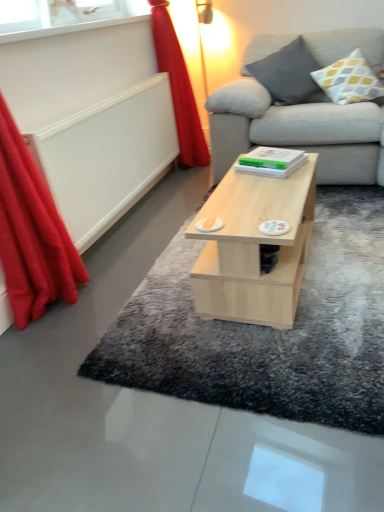
Where is `blank space above light gray shaggy rug at center (from a real-world perspective)`? The width and height of the screenshot is (384, 512). blank space above light gray shaggy rug at center (from a real-world perspective) is located at coordinates (304, 273).